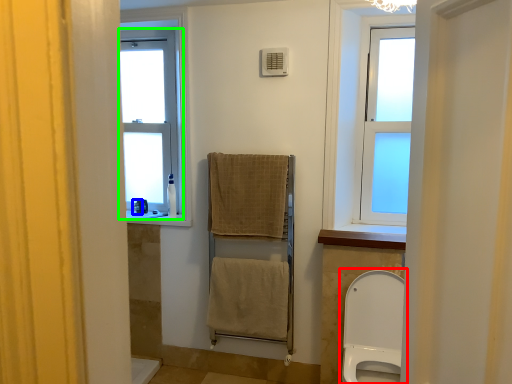
Question: Which object is positioned closest to toilet (highlighted by a red box)? Select from toiletry (highlighted by a blue box) and window (highlighted by a green box).

Choices:
 (A) toiletry
 (B) window

Answer: (B)